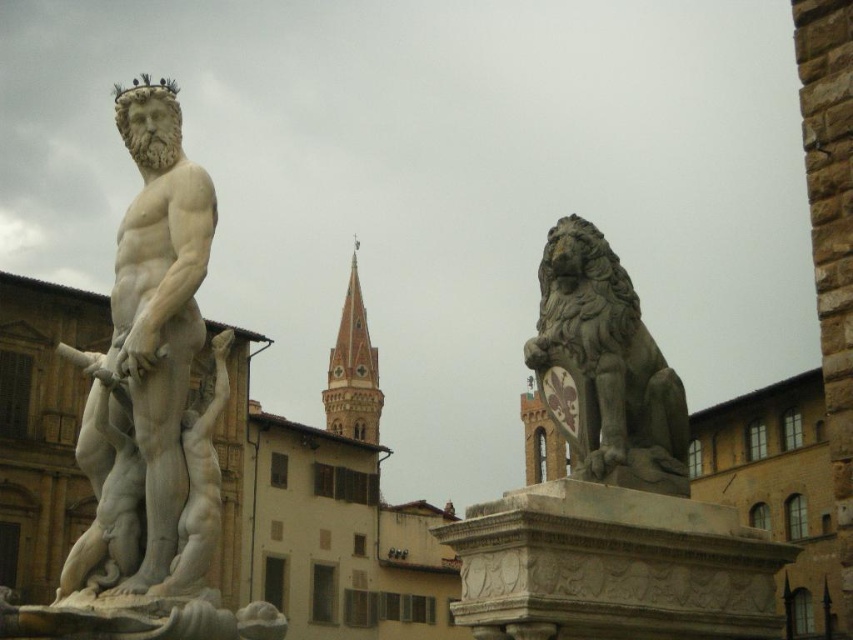
Question: Can you confirm if polished stone lion at right is positioned below gold metallic crown at upper center?

Choices:
 (A) no
 (B) yes

Answer: (B)

Question: Is white marble statue at center to the left of gold metallic crown at upper center from the viewer's perspective?

Choices:
 (A) no
 (B) yes

Answer: (B)

Question: Which point is farther to the camera?

Choices:
 (A) (165, 84)
 (B) (144, 433)

Answer: (A)

Question: Which object appears closest to the camera in this image?

Choices:
 (A) white marble statue at center
 (B) gold metallic crown at upper center

Answer: (A)

Question: Does white marble statue at center appear under gold metallic crown at upper center?

Choices:
 (A) no
 (B) yes

Answer: (B)

Question: Which point is closer to the camera taking this photo?

Choices:
 (A) (132, 84)
 (B) (123, 308)
 (C) (636, 324)

Answer: (B)